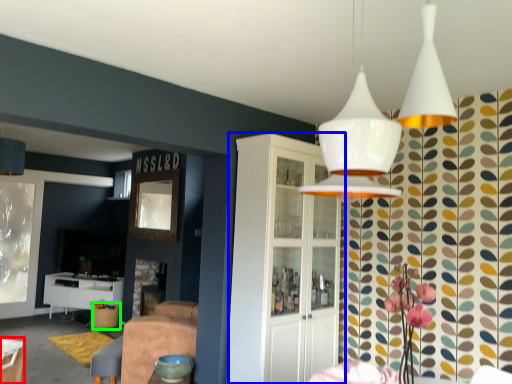
Question: Based on their relative distances, which object is farther from table (highlighted by a red box)? Choose from cabinetry (highlighted by a blue box) and bar stool (highlighted by a green box).

Choices:
 (A) cabinetry
 (B) bar stool

Answer: (B)